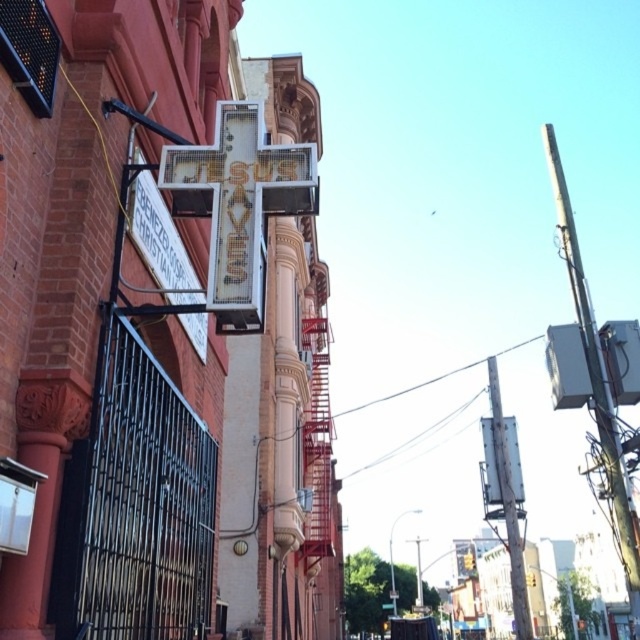
Who is positioned more to the right, metallic gray pole at upper right or metallic gray sign at upper right?

metallic gray pole at upper right

Does point (560, 182) come closer to viewer compared to point (522, 563)?

Yes, it is in front of point (522, 563).

At what (x,y) coordinates should I click in order to perform the action: click on metallic gray pole at upper right. Please return your answer as a coordinate pair (x, y). Looking at the image, I should click on 595,376.